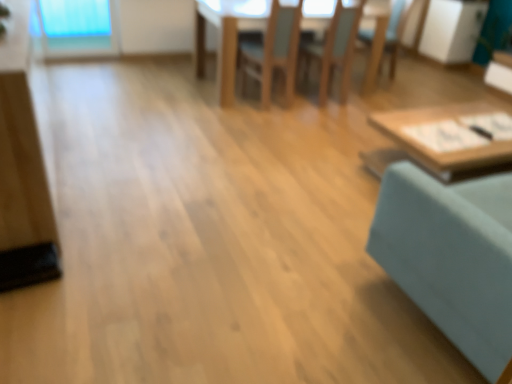
At what (x,y) coordinates should I click in order to perform the action: click on wooden chair at center, arranged as the second chair when viewed from the left. Please return your answer as a coordinate pair (x, y). Looking at the image, I should click on (335, 49).

What do you see at coordinates (227, 36) in the screenshot? The height and width of the screenshot is (384, 512). I see `wooden table at center, which is counted as the first table, starting from the back` at bounding box center [227, 36].

Locate an element on the screen. The width and height of the screenshot is (512, 384). wooden chair at center, arranged as the second chair when viewed from the left is located at coordinates (335, 49).

Is wooden chair at center, the third chair in the left-to-right sequence, not near wooden chair at center, which is counted as the second chair, starting from the right?

Yes, wooden chair at center, the third chair in the left-to-right sequence, and wooden chair at center, which is counted as the second chair, starting from the right, are located far from each other.

Is point (406, 15) closer or farther from the camera than point (346, 65)?

Point (406, 15) appears to be farther away from the viewer than point (346, 65).

Is wooden chair at center, the third chair in the left-to-right sequence, positioned with its back to wooden chair at center, which is counted as the second chair, starting from the right?

No.

At what (x,y) coordinates should I click in order to perform the action: click on chair located above the wooden chair at center, arranged as the second chair when viewed from the left (from the image's perspective). Please return your answer as a coordinate pair (x, y). This screenshot has height=384, width=512. Looking at the image, I should click on (384, 41).

Based on the photo, is wooden chair at center, which is counted as the second chair, starting from the right, located outside wooden tray at right, the 1th table viewed from the front?

wooden chair at center, which is counted as the second chair, starting from the right, lies outside wooden tray at right, the 1th table viewed from the front,'s area.

Does point (347, 47) come behind point (417, 141)?

Yes.

Which is behind, wooden chair at center, arranged as the second chair when viewed from the left, or wooden tray at right, the 2th table positioned from the back?

wooden chair at center, arranged as the second chair when viewed from the left, is further away from the camera.

Is teal fabric swivel chair at right far from wooden table at center, which is counted as the first table, starting from the back?

Absolutely, teal fabric swivel chair at right is distant from wooden table at center, which is counted as the first table, starting from the back.

From the image's perspective, is teal fabric swivel chair at right beneath wooden table at center, which is counted as the first table, starting from the back?

Yes, from the image's perspective, teal fabric swivel chair at right is below wooden table at center, which is counted as the first table, starting from the back.

Measure the distance from teal fabric swivel chair at right to wooden table at center, the 2th table from the bottom.

2.40 meters.

Could you tell me if teal fabric swivel chair at right is facing wooden table at center, which is counted as the first table, starting from the back?

Yes, teal fabric swivel chair at right faces towards wooden table at center, which is counted as the first table, starting from the back.

Does wooden table at center, which is counted as the first table, starting from the back, come in front of wooden chair at center, which is the 1th chair from left to right?

No, wooden table at center, which is counted as the first table, starting from the back, is behind wooden chair at center, which is the 1th chair from left to right.

From their relative heights in the image, would you say wooden table at center, which is counted as the first table, starting from the back, is taller or shorter than wooden chair at center, positioned as the 3th chair in right-to-left order?

Considering their sizes, wooden table at center, which is counted as the first table, starting from the back, has less height than wooden chair at center, positioned as the 3th chair in right-to-left order.

At what (x,y) coordinates should I click in order to perform the action: click on the 1st table counting from the right of the wooden chair at center, positioned as the 3th chair in right-to-left order. Please return your answer as a coordinate pair (x, y). The width and height of the screenshot is (512, 384). Looking at the image, I should click on (227, 36).

Between wooden table at center, the second table when ordered from front to back, and wooden chair at center, which is the 1th chair from left to right, which one has larger size?

wooden table at center, the second table when ordered from front to back.

Considering the relative sizes of wooden chair at center, the third chair in the left-to-right sequence, and wooden tray at right, the 2th table positioned from the back, in the image provided, is wooden chair at center, the third chair in the left-to-right sequence, thinner than wooden tray at right, the 2th table positioned from the back,?

Yes, wooden chair at center, the third chair in the left-to-right sequence, is thinner than wooden tray at right, the 2th table positioned from the back.

Is wooden chair at center, the third chair in the left-to-right sequence, to the right of wooden tray at right, the 2th table positioned from the back, from the viewer's perspective?

Yes, wooden chair at center, the third chair in the left-to-right sequence, is to the right of wooden tray at right, the 2th table positioned from the back.

From the image's perspective, would you say wooden chair at center, the third chair in the left-to-right sequence, is positioned over wooden tray at right, the 2th table positioned from the back?

Yes.

Does point (381, 33) come in front of point (487, 159)?

No, it is behind (487, 159).

From the image's perspective, which is above, wooden chair at center, which is the 1th chair from left to right, or wooden tray at right, the 2th table in the top-to-bottom sequence?

From the image's view, wooden chair at center, which is the 1th chair from left to right, is above.

Can you see wooden chair at center, positioned as the 3th chair in right-to-left order, touching wooden tray at right, the 2th table positioned from the back?

No, wooden chair at center, positioned as the 3th chair in right-to-left order, is not making contact with wooden tray at right, the 2th table positioned from the back.

Is wooden chair at center, positioned as the 3th chair in right-to-left order, spatially inside wooden tray at right, the 2th table in the top-to-bottom sequence, or outside of it?

wooden chair at center, positioned as the 3th chair in right-to-left order, exists outside the volume of wooden tray at right, the 2th table in the top-to-bottom sequence.

Considering the relative sizes of wooden chair at center, which is the 1th chair from left to right, and wooden tray at right, the 1th table viewed from the front, in the image provided, is wooden chair at center, which is the 1th chair from left to right, smaller than wooden tray at right, the 1th table viewed from the front,?

Yes, wooden chair at center, which is the 1th chair from left to right, is smaller than wooden tray at right, the 1th table viewed from the front.

Is the depth of matte wood dresser at left less than that of wooden chair at center, arranged as the second chair when viewed from the left?

Yes, matte wood dresser at left is in front of wooden chair at center, arranged as the second chair when viewed from the left.

Is matte wood dresser at left situated inside wooden chair at center, which is counted as the second chair, starting from the right, or outside?

The correct answer is: outside.

Is matte wood dresser at left bigger than wooden chair at center, which is counted as the second chair, starting from the right?

Correct, matte wood dresser at left is larger in size than wooden chair at center, which is counted as the second chair, starting from the right.

Where is `dresser below the wooden chair at center, which is counted as the second chair, starting from the right (from a real-world perspective)`? This screenshot has width=512, height=384. dresser below the wooden chair at center, which is counted as the second chair, starting from the right (from a real-world perspective) is located at coordinates (22, 168).

The width and height of the screenshot is (512, 384). What are the coordinates of `chair that is the 2nd one above the wooden chair at center, the third chair in the left-to-right sequence (from a real-world perspective)` in the screenshot? It's located at (335, 49).

Locate an element on the screen. This screenshot has width=512, height=384. table that appears below the wooden chair at center, which is counted as the second chair, starting from the right (from the image's perspective) is located at coordinates (444, 140).

Consider the image. From the image, which object appears to be nearer to wooden chair at center, which is counted as the second chair, starting from the right, teal fabric swivel chair at right or wooden tray at right, the 1th table viewed from the front?

wooden tray at right, the 1th table viewed from the front, is closer to wooden chair at center, which is counted as the second chair, starting from the right.

Based on their spatial positions, is teal fabric swivel chair at right or wooden chair at center, which is counted as the second chair, starting from the right, closer to wooden chair at center, the 1th chair when ordered from right to left?

Based on the image, wooden chair at center, which is counted as the second chair, starting from the right, appears to be nearer to wooden chair at center, the 1th chair when ordered from right to left.

Based on their spatial positions, is wooden tray at right, which is counted as the first table, starting from the bottom, or wooden table at center, the 2th table from the bottom, further from wooden chair at center, arranged as the second chair when viewed from the left?

The object further to wooden chair at center, arranged as the second chair when viewed from the left, is wooden tray at right, which is counted as the first table, starting from the bottom.

Estimate the real-world distances between objects in this image. Which object is closer to wooden chair at center, which is counted as the second chair, starting from the right, wooden chair at center, positioned as the 3th chair in right-to-left order, or wooden chair at center, the 1th chair when ordered from right to left?

wooden chair at center, positioned as the 3th chair in right-to-left order, is positioned closer to the anchor wooden chair at center, which is counted as the second chair, starting from the right.

Which object lies nearer to the anchor point teal fabric swivel chair at right, wooden tray at right, the 1th table viewed from the front, or wooden table at center, which is counted as the first table, starting from the back?

The object closer to teal fabric swivel chair at right is wooden tray at right, the 1th table viewed from the front.

From the image, which object appears to be farther from wooden chair at center, the third chair in the left-to-right sequence, wooden table at center, the 2th table from the bottom, or matte wood dresser at left?

Based on the image, matte wood dresser at left appears to be further to wooden chair at center, the third chair in the left-to-right sequence.

Estimate the real-world distances between objects in this image. Which object is closer to teal fabric swivel chair at right, wooden table at center, the second table when ordered from front to back, or wooden chair at center, the 1th chair when ordered from right to left?

Among the two, wooden table at center, the second table when ordered from front to back, is located nearer to teal fabric swivel chair at right.

Based on their spatial positions, is wooden chair at center, which is counted as the second chair, starting from the right, or wooden chair at center, the third chair in the left-to-right sequence, closer to wooden chair at center, which is the 1th chair from left to right?

The object closer to wooden chair at center, which is the 1th chair from left to right, is wooden chair at center, which is counted as the second chair, starting from the right.

I want to click on chair between wooden chair at center, positioned as the 3th chair in right-to-left order, and wooden chair at center, the 1th chair when ordered from right to left, in the horizontal direction, so click(x=335, y=49).

Locate an element on the screen. Image resolution: width=512 pixels, height=384 pixels. table located between wooden chair at center, which is the 1th chair from left to right, and wooden tray at right, which is counted as the first table, starting from the bottom, in the left-right direction is located at coordinates (227, 36).

The height and width of the screenshot is (384, 512). In order to click on table positioned between wooden tray at right, the 1th table viewed from the front, and wooden chair at center, the 1th chair when ordered from right to left, from near to far in this screenshot , I will do `click(227, 36)`.

At what (x,y) coordinates should I click in order to perform the action: click on table between matte wood dresser at left and wooden tray at right, which is counted as the first table, starting from the bottom. Please return your answer as a coordinate pair (x, y). Looking at the image, I should click on (227, 36).